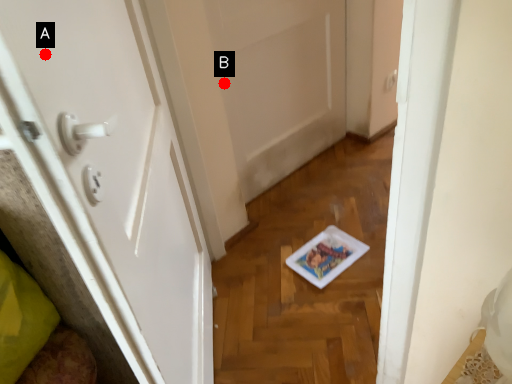
Question: Two points are circled on the image, labeled by A and B beside each circle. Which point appears closest to the camera in this image?

Choices:
 (A) A is closer
 (B) B is closer

Answer: (A)